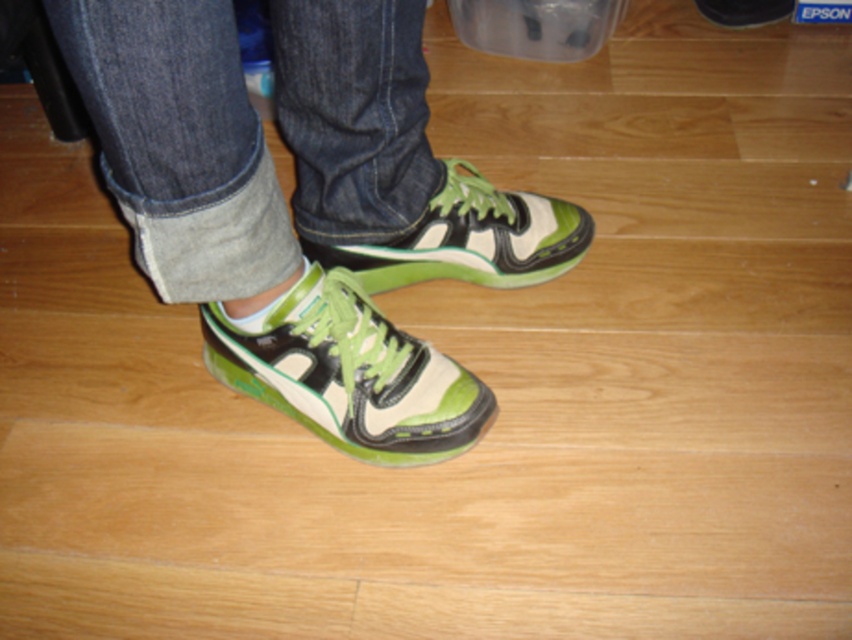
Question: Among these objects, which one is farthest from the camera?

Choices:
 (A) green matte/suede sneaker at center
 (B) green matte/suede sneaker at lower center
 (C) green matte sneakers at center

Answer: (A)

Question: Can you confirm if green matte sneakers at center is wider than green matte/suede sneaker at center?

Choices:
 (A) no
 (B) yes

Answer: (B)

Question: Which point is farther from the camera taking this photo?

Choices:
 (A) (482, 177)
 (B) (320, 332)
 (C) (441, 424)

Answer: (A)

Question: Does green matte sneakers at center lie behind green matte/suede sneaker at center?

Choices:
 (A) no
 (B) yes

Answer: (A)

Question: Is green matte/suede sneaker at lower center closer to camera compared to green matte/suede sneaker at center?

Choices:
 (A) no
 (B) yes

Answer: (B)

Question: Which object is the farthest from the green matte/suede sneaker at lower center?

Choices:
 (A) green matte sneakers at center
 (B) green matte/suede sneaker at center

Answer: (B)